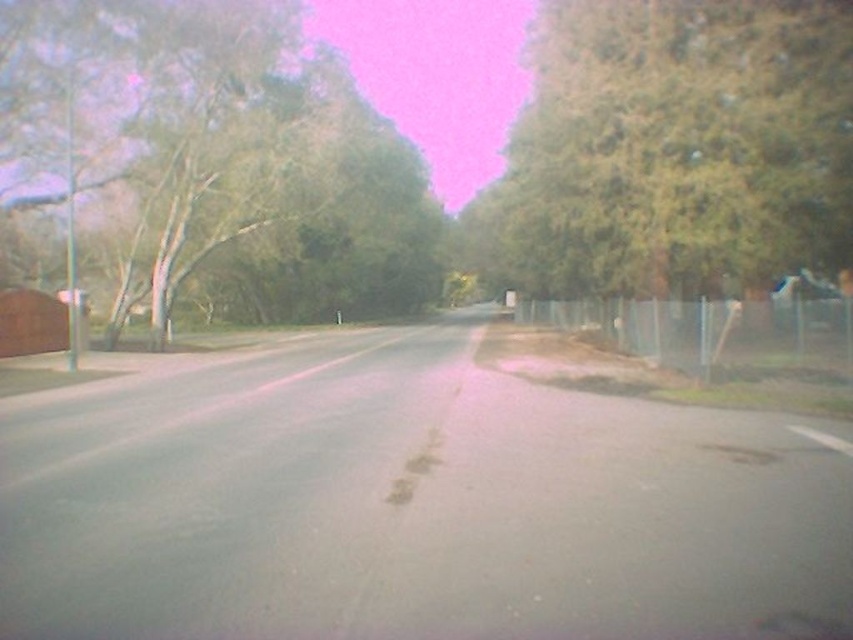
Question: Can you confirm if green leafy tree at right is positioned below metallic silver fence at right?

Choices:
 (A) yes
 (B) no

Answer: (B)

Question: Which object is farther from the camera taking this photo?

Choices:
 (A) metallic silver fence at right
 (B) green leafy tree at right
 (C) green leafy tree at left

Answer: (C)

Question: In this image, where is green leafy tree at left located relative to green leafy tree at right?

Choices:
 (A) below
 (B) above

Answer: (A)

Question: Which point is farther to the camera?

Choices:
 (A) (837, 362)
 (B) (583, 33)

Answer: (B)

Question: Which point is closer to the camera taking this photo?

Choices:
 (A) (851, 336)
 (B) (202, 240)

Answer: (A)

Question: Does green leafy tree at left lie behind metallic silver fence at right?

Choices:
 (A) yes
 (B) no

Answer: (A)